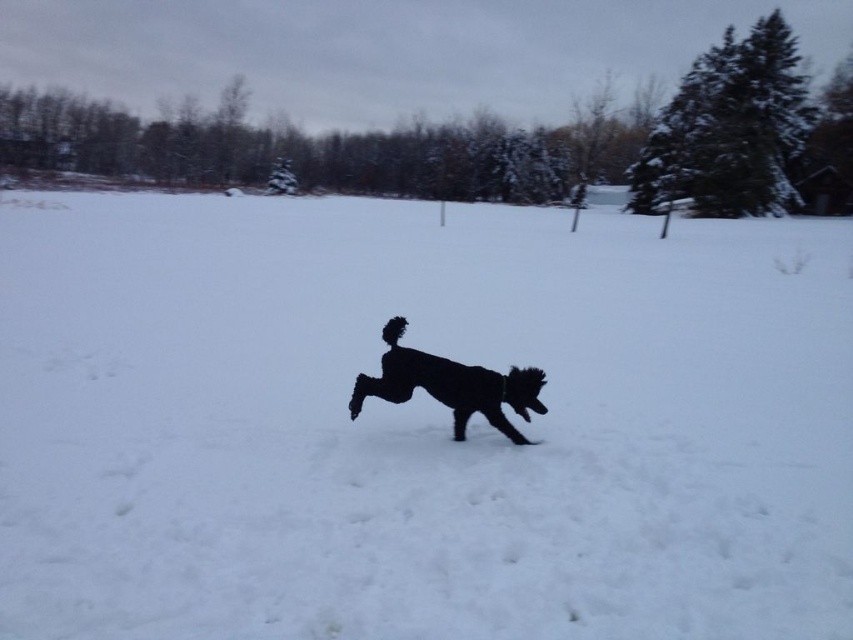
Is point (195, 310) closer to viewer compared to point (410, 364)?

No, (195, 310) is behind (410, 364).

Does white fluffy snow at center have a larger size compared to black fluffy dog at center?

Correct, white fluffy snow at center is larger in size than black fluffy dog at center.

Between point (167, 598) and point (403, 332), which one is positioned behind?

The point (403, 332) is more distant.

You are a GUI agent. You are given a task and a screenshot of the screen. Output one action in this format:
    pyautogui.click(x=<x>, y=<y>)
    Task: Click on the white fluffy snow at center
    This screenshot has height=640, width=853.
    Given the screenshot: What is the action you would take?
    pyautogui.click(x=418, y=422)